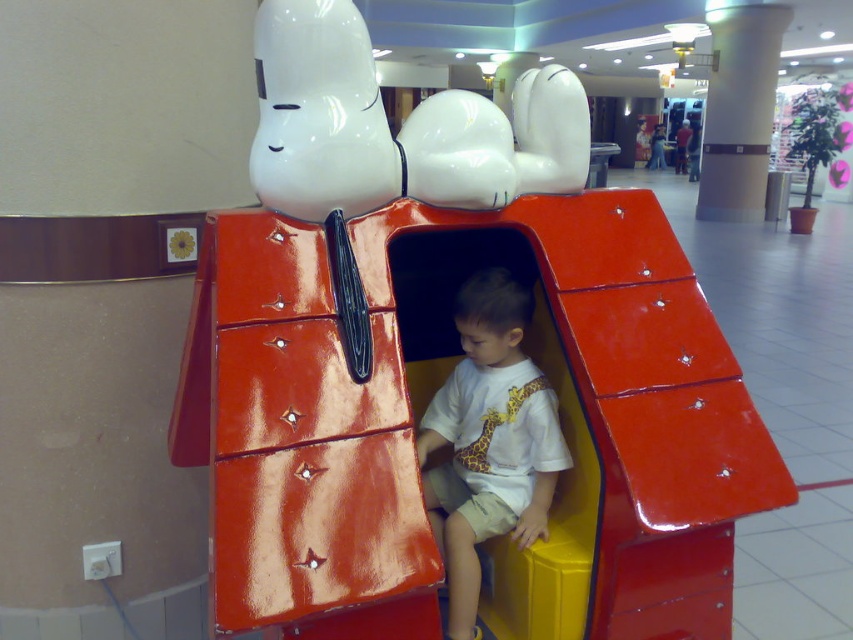
You are a parent looking for your child in the mall. You see the white glossy pillar at center and the white matte shirt at center. Which object is closer to you?

The white glossy pillar at center is closer to you because the white matte shirt at center is located below it, meaning the pillar is above the shirt and thus nearer in the visual hierarchy.

You are a parent with a 1.3 meter tall child. You want to take a photo of your child with the white glossy snoopy at upper center. Can your child stand on the yellow seat inside the red structure to reach the same height as the snoopy figure?

The distance between the white glossy snoopy at upper center and the camera is 1.42 meters. Since the child is 1.3 meters tall, standing on the yellow seat inside the red structure would allow them to reach approximately the same height as the snoopy figure, making the photo possible.

You are a parent standing next to the red structure and want to hand a small toy to your child sitting on the yellow seat inside the structure. The toy is currently in your pocket, and you need to reach it to the child. Considering the distance between the white glossy snoopy at upper center and the white matte shirt at center, can you estimate if you can comfortably reach the child without needing to stretch too much?

The distance between the white glossy snoopy at upper center and the white matte shirt at center is 56.51 centimeters. Since this distance likely represents the space between the snoopy figure and the child, you can comfortably reach the child without stretching too much as the distance is within a typical comfortable reaching range for an adult.